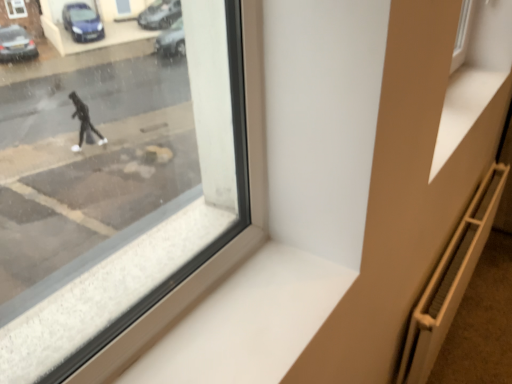
Question: Is metallic radiator at lower right bigger than brown textured radiator at lower right?

Choices:
 (A) no
 (B) yes

Answer: (B)

Question: Is metallic radiator at lower right wider than brown textured radiator at lower right?

Choices:
 (A) yes
 (B) no

Answer: (B)

Question: Would you say metallic radiator at lower right is a long distance from brown textured radiator at lower right?

Choices:
 (A) no
 (B) yes

Answer: (A)

Question: From the image's perspective, is metallic radiator at lower right above brown textured radiator at lower right?

Choices:
 (A) yes
 (B) no

Answer: (A)

Question: Does metallic radiator at lower right come behind brown textured radiator at lower right?

Choices:
 (A) yes
 (B) no

Answer: (B)

Question: In terms of size, does white smooth window sill at lower center appear bigger or smaller than brown textured radiator at lower right?

Choices:
 (A) big
 (B) small

Answer: (B)

Question: Relative to brown textured radiator at lower right, is white smooth window sill at lower center in front or behind?

Choices:
 (A) front
 (B) behind

Answer: (A)

Question: Considering the positions of white smooth window sill at lower center and brown textured radiator at lower right in the image, is white smooth window sill at lower center taller or shorter than brown textured radiator at lower right?

Choices:
 (A) tall
 (B) short

Answer: (B)

Question: Considering the positions of point (292, 354) and point (506, 243), is point (292, 354) closer or farther from the camera than point (506, 243)?

Choices:
 (A) closer
 (B) farther

Answer: (A)

Question: Based on their positions, is metallic radiator at lower right located to the left or right of brown textured radiator at lower right?

Choices:
 (A) right
 (B) left

Answer: (B)

Question: From their relative heights in the image, would you say metallic radiator at lower right is taller or shorter than brown textured radiator at lower right?

Choices:
 (A) tall
 (B) short

Answer: (A)

Question: From the image's perspective, is metallic radiator at lower right above or below brown textured radiator at lower right?

Choices:
 (A) below
 (B) above

Answer: (B)

Question: In terms of width, does metallic radiator at lower right look wider or thinner when compared to brown textured radiator at lower right?

Choices:
 (A) thin
 (B) wide

Answer: (A)

Question: Considering their positions, is brown textured radiator at lower right located in front of or behind white smooth window sill at lower center?

Choices:
 (A) behind
 (B) front

Answer: (A)

Question: In terms of size, does brown textured radiator at lower right appear bigger or smaller than white smooth window sill at lower center?

Choices:
 (A) big
 (B) small

Answer: (A)